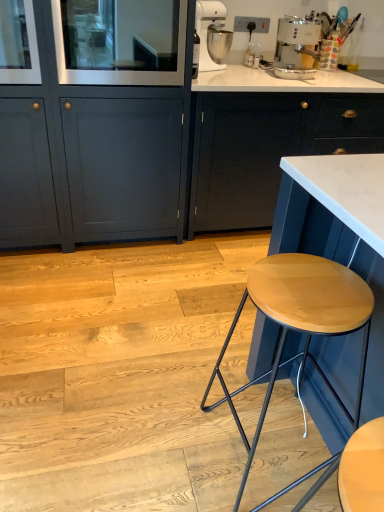
Question: Considering the positions of matte dark blue cabinet at center, marked as the second cabinetry in a left-to-right arrangement, and clear glass door at upper left in the image, is matte dark blue cabinet at center, marked as the second cabinetry in a left-to-right arrangement, wider or thinner than clear glass door at upper left?

Choices:
 (A) wide
 (B) thin

Answer: (A)

Question: Is point (243, 168) closer or farther from the camera than point (185, 10)?

Choices:
 (A) farther
 (B) closer

Answer: (A)

Question: Which object is positioned farthest from the matte gray cabinet at lower left, positioned as the 1th cabinetry in left-to-right order?

Choices:
 (A) matte dark blue cabinet at center, the 1th cabinetry when ordered from right to left
 (B) white glossy coffee machine at upper right
 (C) wooden stool at right
 (D) white metallic stand mixer at upper center
 (E) clear glass door at upper left

Answer: (C)

Question: Estimate the real-world distances between objects in this image. Which object is closer to the wooden stool at right?

Choices:
 (A) clear glass door at upper left
 (B) matte dark blue cabinet at center, marked as the second cabinetry in a left-to-right arrangement
 (C) white glossy coffee machine at upper right
 (D) matte gray cabinet at lower left, positioned as the 1th cabinetry in left-to-right order
 (E) white metallic stand mixer at upper center

Answer: (B)